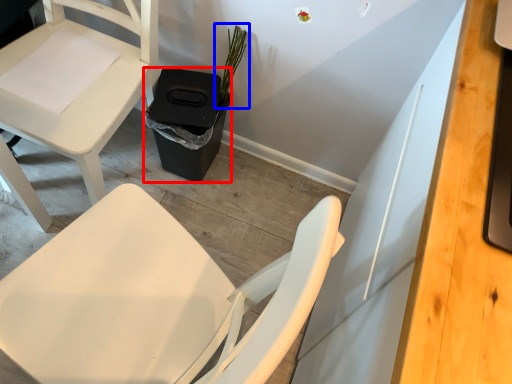
Question: Which object appears farthest to the camera in this image, trash bin/can (highlighted by a red box) or plant (highlighted by a blue box)?

Choices:
 (A) trash bin/can
 (B) plant

Answer: (A)